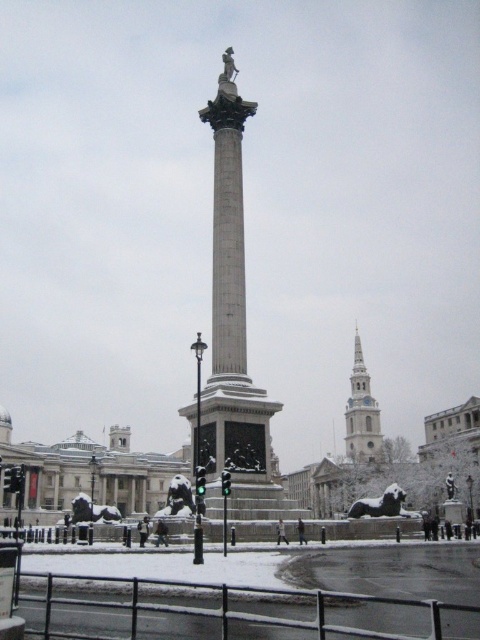
Question: Which object is closer to the camera taking this photo?

Choices:
 (A) white stone spire at upper right
 (B) bronze lion at lower right

Answer: (B)

Question: Among these objects, which one is nearest to the camera?

Choices:
 (A) white stone spire at upper right
 (B) bronze lion at lower right
 (C) smooth stone column at center

Answer: (C)

Question: Is white stone spire at upper right to the left of bronze lion at lower right from the viewer's perspective?

Choices:
 (A) no
 (B) yes

Answer: (A)

Question: Can you confirm if smooth stone column at center is positioned to the left of white stone spire at upper right?

Choices:
 (A) yes
 (B) no

Answer: (A)

Question: Which point is farther to the camera?

Choices:
 (A) (225, 422)
 (B) (357, 403)
 (C) (397, 486)

Answer: (B)

Question: Does smooth stone column at center lie in front of white stone spire at upper right?

Choices:
 (A) yes
 (B) no

Answer: (A)